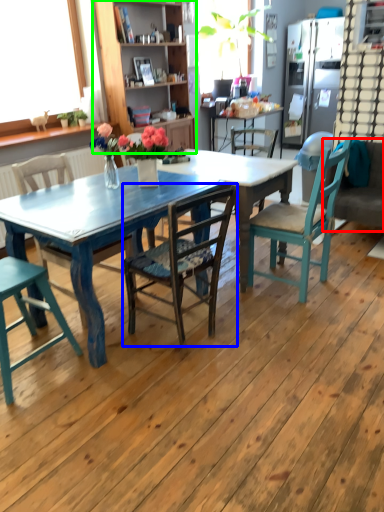
Question: Considering the real-world distances, which object is closest to couch (highlighted by a red box)? chair (highlighted by a blue box) or cabinetry (highlighted by a green box).

Choices:
 (A) chair
 (B) cabinetry

Answer: (A)